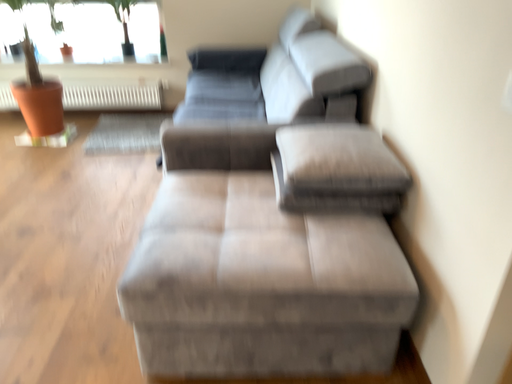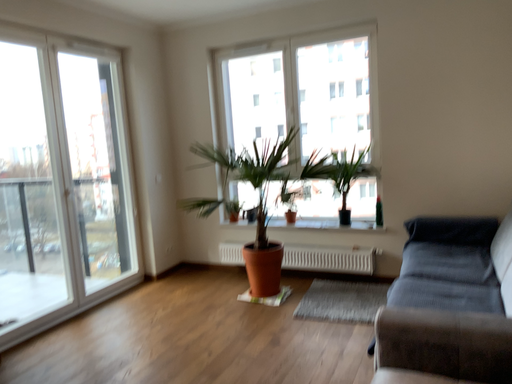
Question: Which way did the camera rotate in the video?

Choices:
 (A) rotated upward
 (B) rotated downward

Answer: (A)